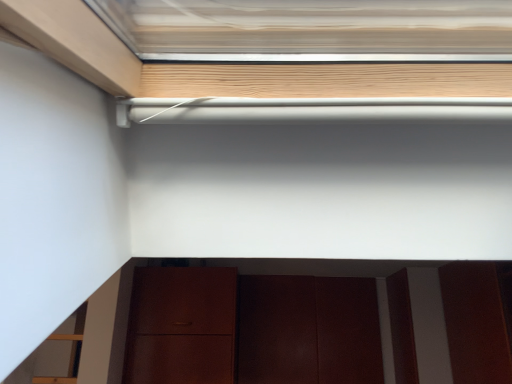
Image resolution: width=512 pixels, height=384 pixels. I want to click on dark wood door at lower center, so click(308, 330).

This screenshot has height=384, width=512. Describe the element at coordinates (308, 330) in the screenshot. I see `dark wood door at lower center` at that location.

The image size is (512, 384). Describe the element at coordinates (316, 326) in the screenshot. I see `matte brown cabinet at lower center` at that location.

Locate an element on the screen. matte brown cabinet at lower center is located at coordinates (316, 326).

Locate an element on the screen. Image resolution: width=512 pixels, height=384 pixels. dark wood door at lower center is located at coordinates (308, 330).

Which object is positioned more to the left, dark wood door at lower center or matte brown cabinet at lower center?

A: dark wood door at lower center is more to the left.

Which is behind, dark wood door at lower center or matte brown cabinet at lower center?

dark wood door at lower center.

Is point (347, 326) more distant than point (278, 282)?

No, (347, 326) is closer to viewer.

From the image's perspective, which one is positioned higher, dark wood door at lower center or matte brown cabinet at lower center?

matte brown cabinet at lower center appears higher in the image.

From a real-world perspective, is dark wood door at lower center beneath matte brown cabinet at lower center?

Yes, from a real-world perspective, dark wood door at lower center is beneath matte brown cabinet at lower center.

Considering the relative sizes of dark wood door at lower center and matte brown cabinet at lower center in the image provided, is dark wood door at lower center thinner than matte brown cabinet at lower center?

Correct, the width of dark wood door at lower center is less than that of matte brown cabinet at lower center.

Which of these two, dark wood door at lower center or matte brown cabinet at lower center, stands taller?

Standing taller between the two is dark wood door at lower center.

Does dark wood door at lower center have a smaller size compared to matte brown cabinet at lower center?

Correct, dark wood door at lower center occupies less space than matte brown cabinet at lower center.

Is dark wood door at lower center surrounding matte brown cabinet at lower center?

No, matte brown cabinet at lower center is not a part of dark wood door at lower center.

Is dark wood door at lower center placed right next to matte brown cabinet at lower center?

No, dark wood door at lower center is not next to matte brown cabinet at lower center.

Is dark wood door at lower center oriented towards matte brown cabinet at lower center?

Yes, dark wood door at lower center is aimed at matte brown cabinet at lower center.

Where is `cabinetry on the right of dark wood door at lower center`? The width and height of the screenshot is (512, 384). cabinetry on the right of dark wood door at lower center is located at coordinates (316, 326).

Considering the positions of objects matte brown cabinet at lower center and dark wood door at lower center in the image provided, who is more to the left, matte brown cabinet at lower center or dark wood door at lower center?

Positioned to the left is dark wood door at lower center.

Is matte brown cabinet at lower center in front of or behind dark wood door at lower center in the image?

matte brown cabinet at lower center is positioned closer to the viewer than dark wood door at lower center.

Considering the positions of points (496, 318) and (262, 379), is point (496, 318) farther from camera compared to point (262, 379)?

No, (496, 318) is in front of (262, 379).

From the image's perspective, is matte brown cabinet at lower center located above dark wood door at lower center?

Yes, from the image's perspective, matte brown cabinet at lower center is above dark wood door at lower center.

From a real-world perspective, who is located higher, matte brown cabinet at lower center or dark wood door at lower center?

matte brown cabinet at lower center is physically above.

Considering the relative sizes of matte brown cabinet at lower center and dark wood door at lower center in the image provided, is matte brown cabinet at lower center thinner than dark wood door at lower center?

In fact, matte brown cabinet at lower center might be wider than dark wood door at lower center.

In terms of height, does matte brown cabinet at lower center look taller or shorter compared to dark wood door at lower center?

Clearly, matte brown cabinet at lower center is shorter compared to dark wood door at lower center.

Between matte brown cabinet at lower center and dark wood door at lower center, which one has larger size?

matte brown cabinet at lower center.

Is matte brown cabinet at lower center outside of dark wood door at lower center?

Yes, matte brown cabinet at lower center is not within dark wood door at lower center.

Is the surface of matte brown cabinet at lower center in direct contact with dark wood door at lower center?

No.

Does matte brown cabinet at lower center turn towards dark wood door at lower center?

No, matte brown cabinet at lower center is not oriented towards dark wood door at lower center.

Consider the image. How different are the orientations of matte brown cabinet at lower center and dark wood door at lower center in degrees?

0.000146 degrees.

The height and width of the screenshot is (384, 512). Find the location of `door behind the matte brown cabinet at lower center`. door behind the matte brown cabinet at lower center is located at coordinates (308, 330).

You are a GUI agent. You are given a task and a screenshot of the screen. Output one action in this format:
    pyautogui.click(x=<x>, y=<y>)
    Task: Click on the door lying behind the matte brown cabinet at lower center
    
    Given the screenshot: What is the action you would take?
    pyautogui.click(x=308, y=330)

Where is `cabinetry lying above the dark wood door at lower center (from the image's perspective)`? The image size is (512, 384). cabinetry lying above the dark wood door at lower center (from the image's perspective) is located at coordinates (316, 326).